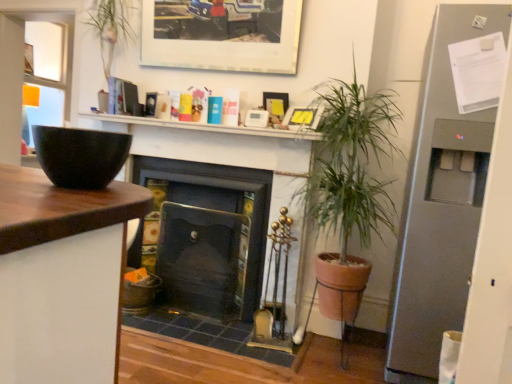
Question: Would you say matte yellow picture frame at upper center, which is counted as the second picture frame, starting from the top, is part of white matte shelf at upper center's contents?

Choices:
 (A) no
 (B) yes

Answer: (A)

Question: Is white matte shelf at upper center thinner than matte yellow picture frame at upper center, which is counted as the 2th picture frame, starting from the bottom?

Choices:
 (A) no
 (B) yes

Answer: (A)

Question: Are white matte shelf at upper center and matte yellow picture frame at upper center, which is counted as the 2th picture frame, starting from the bottom, beside each other?

Choices:
 (A) yes
 (B) no

Answer: (B)

Question: Can you confirm if white matte shelf at upper center is bigger than matte yellow picture frame at upper center, which is counted as the second picture frame, starting from the top?

Choices:
 (A) no
 (B) yes

Answer: (B)

Question: From a real-world perspective, is white matte shelf at upper center physically above matte yellow picture frame at upper center, which is counted as the second picture frame, starting from the top?

Choices:
 (A) yes
 (B) no

Answer: (B)

Question: Is white matte shelf at upper center closer to the viewer compared to matte yellow picture frame at upper center, which is counted as the second picture frame, starting from the top?

Choices:
 (A) yes
 (B) no

Answer: (A)

Question: Does matte white picture frame at upper center, placed as the third picture frame when sorted from bottom to top, have a lesser width compared to matte yellow picture frame at upper center, which is counted as the second picture frame, starting from the top?

Choices:
 (A) no
 (B) yes

Answer: (A)

Question: Is matte white picture frame at upper center, placed as the third picture frame when sorted from bottom to top, completely or partially outside of matte yellow picture frame at upper center, which is counted as the second picture frame, starting from the top?

Choices:
 (A) yes
 (B) no

Answer: (A)

Question: Is the depth of matte white picture frame at upper center, placed as the third picture frame when sorted from bottom to top, greater than that of matte yellow picture frame at upper center, which is counted as the 2th picture frame, starting from the bottom?

Choices:
 (A) no
 (B) yes

Answer: (A)

Question: Is the surface of matte white picture frame at upper center, placed as the third picture frame when sorted from bottom to top, in direct contact with matte yellow picture frame at upper center, which is counted as the 2th picture frame, starting from the bottom?

Choices:
 (A) no
 (B) yes

Answer: (A)

Question: From a real-world perspective, is matte white picture frame at upper center, which is counted as the 1th picture frame, starting from the top, on matte yellow picture frame at upper center, which is counted as the 2th picture frame, starting from the bottom?

Choices:
 (A) yes
 (B) no

Answer: (A)

Question: Does matte white picture frame at upper center, which is counted as the 1th picture frame, starting from the top, have a greater height compared to matte yellow picture frame at upper center, which is counted as the 2th picture frame, starting from the bottom?

Choices:
 (A) yes
 (B) no

Answer: (A)

Question: Does matte black fireplace at center, the 2th fireplace viewed from the right, turn towards matte yellow picture frame at upper center, which is counted as the 2th picture frame, starting from the bottom?

Choices:
 (A) no
 (B) yes

Answer: (A)